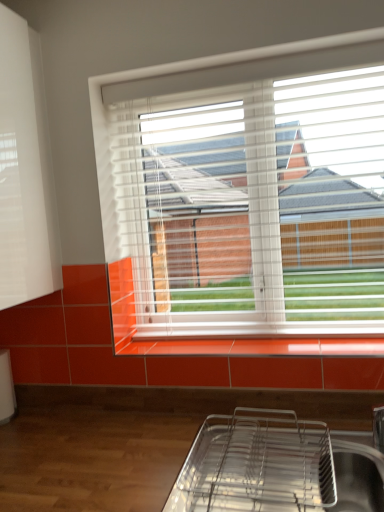
Question: From the image's perspective, is metallic silver tray at lower center located beneath white plastic blinds at upper center?

Choices:
 (A) no
 (B) yes

Answer: (B)

Question: Is metallic silver tray at lower center taller than white plastic blinds at upper center?

Choices:
 (A) yes
 (B) no

Answer: (B)

Question: Is metallic silver tray at lower center positioned with its back to white plastic blinds at upper center?

Choices:
 (A) yes
 (B) no

Answer: (B)

Question: Are metallic silver tray at lower center and white plastic blinds at upper center making contact?

Choices:
 (A) no
 (B) yes

Answer: (A)

Question: Does metallic silver tray at lower center have a lesser width compared to white plastic blinds at upper center?

Choices:
 (A) yes
 (B) no

Answer: (B)

Question: From a real-world perspective, is metallic silver tray at lower center located higher than white plastic blinds at upper center?

Choices:
 (A) no
 (B) yes

Answer: (A)

Question: Is metallic silver tray at lower center with orange glossy tile at lower center?

Choices:
 (A) no
 (B) yes

Answer: (A)

Question: From a real-world perspective, is metallic silver tray at lower center over orange glossy tile at lower center?

Choices:
 (A) yes
 (B) no

Answer: (B)

Question: Is metallic silver tray at lower center further to the viewer compared to orange glossy tile at lower center?

Choices:
 (A) yes
 (B) no

Answer: (B)

Question: Is metallic silver tray at lower center oriented away from orange glossy tile at lower center?

Choices:
 (A) no
 (B) yes

Answer: (A)

Question: From a real-world perspective, is metallic silver tray at lower center positioned under orange glossy tile at lower center based on gravity?

Choices:
 (A) no
 (B) yes

Answer: (B)

Question: Is metallic silver tray at lower center to the right of orange glossy tile at lower center from the viewer's perspective?

Choices:
 (A) no
 (B) yes

Answer: (A)

Question: Considering the relative sizes of metallic silver tray at lower center and white matte shutter at upper left in the image provided, is metallic silver tray at lower center smaller than white matte shutter at upper left?

Choices:
 (A) no
 (B) yes

Answer: (B)